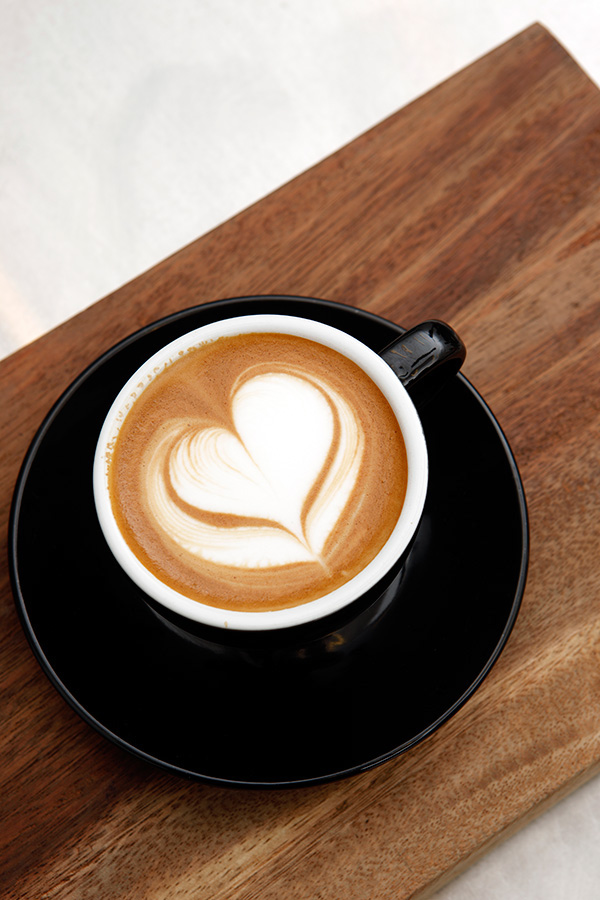
You are a GUI agent. You are given a task and a screenshot of the screen. Output one action in this format:
    pyautogui.click(x=<x>, y=<y>)
    Task: Click on the rim of coffee mug
    The image size is (600, 900).
    Given the screenshot: What is the action you would take?
    (x=371, y=572)